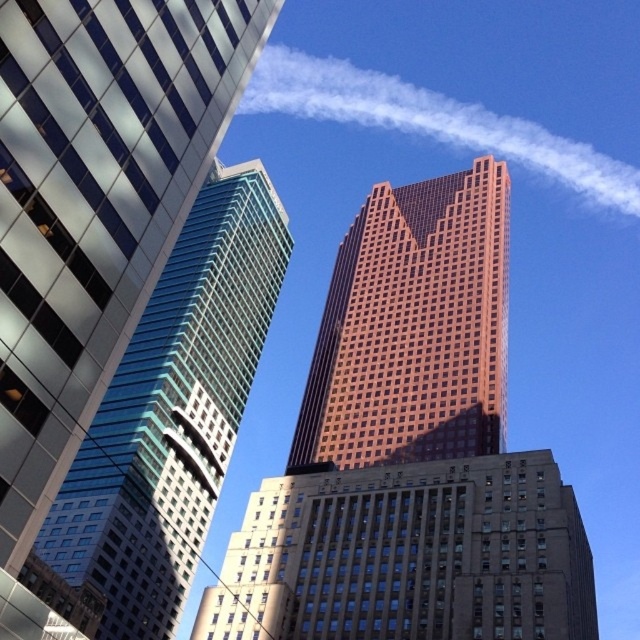
Question: Which of the following is the closest to the observer?

Choices:
 (A) glassy teal skyscraper at center-left
 (B) white vapor at upper center
 (C) orange glass skyscraper at center
 (D) brown brick building at center

Answer: (A)

Question: Which object is closer to the camera taking this photo?

Choices:
 (A) white vapor at upper center
 (B) orange glass skyscraper at center
 (C) brown brick building at center
 (D) glassy teal skyscraper at center-left

Answer: (D)

Question: Does brown brick building at center have a larger size compared to glassy teal skyscraper at center-left?

Choices:
 (A) yes
 (B) no

Answer: (B)

Question: Does brown brick building at center appear under white vapor at upper center?

Choices:
 (A) no
 (B) yes

Answer: (B)

Question: Which point appears closest to the camera in this image?

Choices:
 (A) (428, 268)
 (B) (333, 106)
 (C) (330, 538)
 (D) (115, 438)

Answer: (C)

Question: Can you confirm if glassy teal skyscraper at center-left is thinner than white vapor at upper center?

Choices:
 (A) yes
 (B) no

Answer: (A)